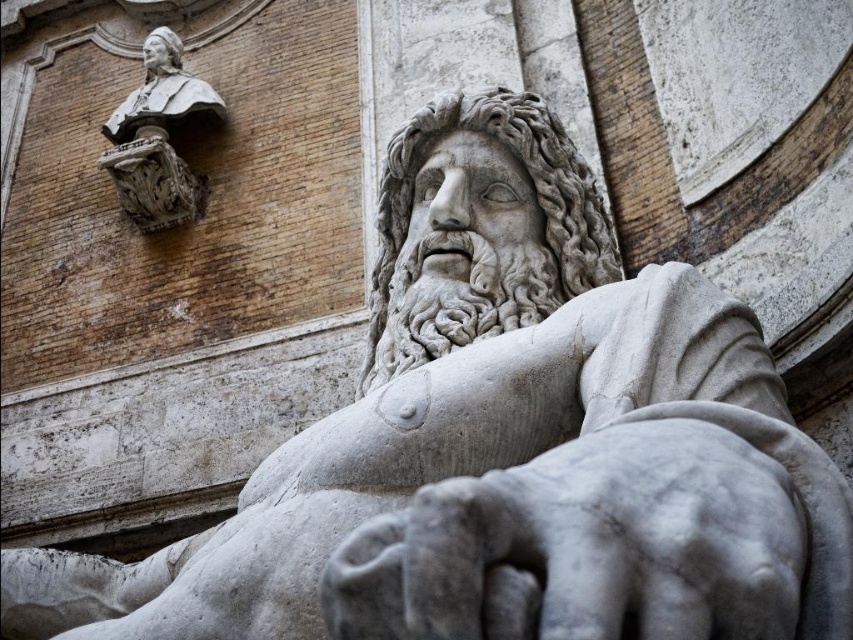
Is point (579, 544) farther from camera compared to point (148, 120)?

No, it is in front of (148, 120).

Is gray stone hand at lower center below matte stone bust at upper left?

Correct, gray stone hand at lower center is located below matte stone bust at upper left.

Which is in front, point (440, 595) or point (154, 97)?

Point (440, 595) is more forward.

I want to click on gray stone hand at lower center, so click(587, 545).